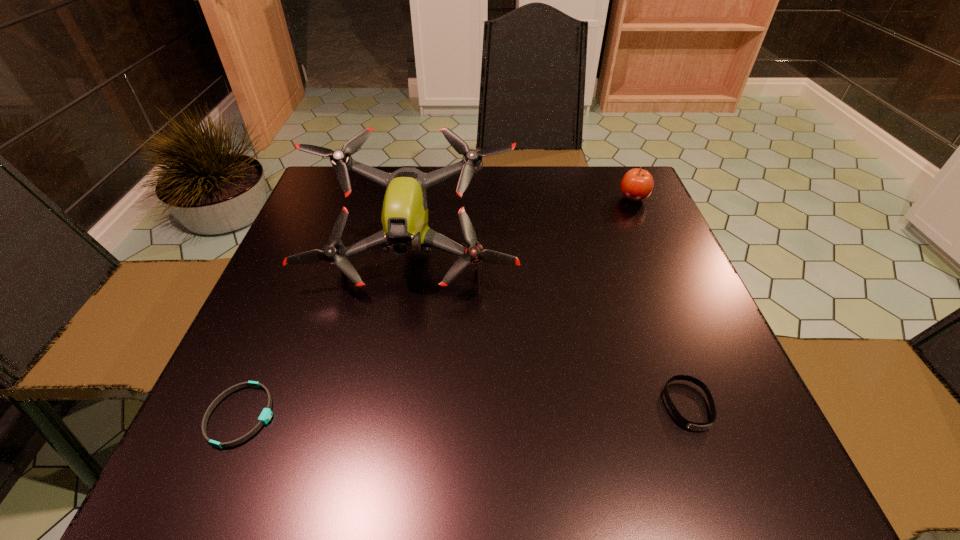
Identify the location of vacant space that satisfies the following two spatial constraints: 1. on the display of the right wristband; 2. on the buckle of the left wristband. (692, 415).

You are a GUI agent. You are given a task and a screenshot of the screen. Output one action in this format:
    pyautogui.click(x=<x>, y=<y>)
    Task: Click on the blank area in the image that satisfies the following two spatial constraints: 1. on the front-facing side of the tallest object; 2. on the buckle of the shorter wristband
    Image resolution: width=960 pixels, height=540 pixels.
    Given the screenshot: What is the action you would take?
    pyautogui.click(x=385, y=415)